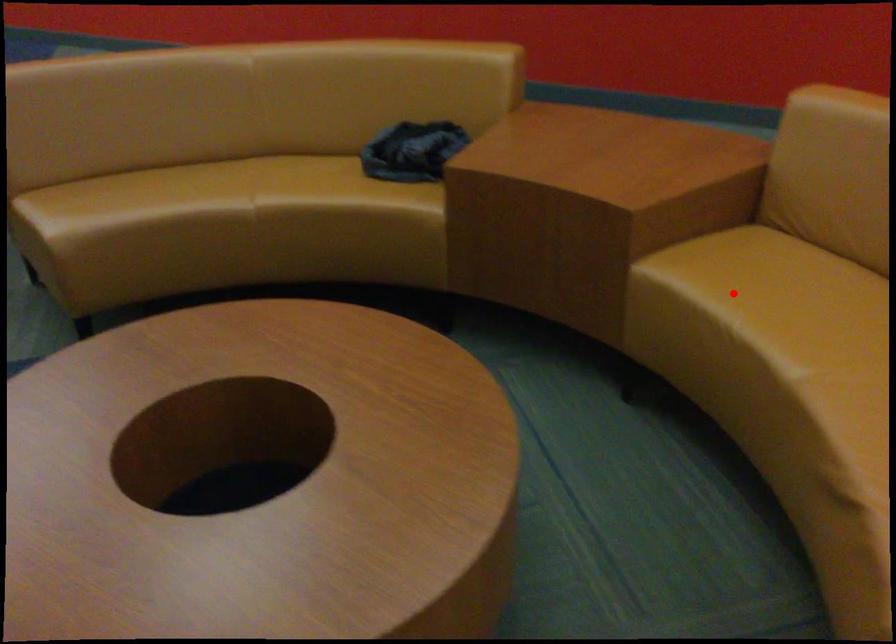
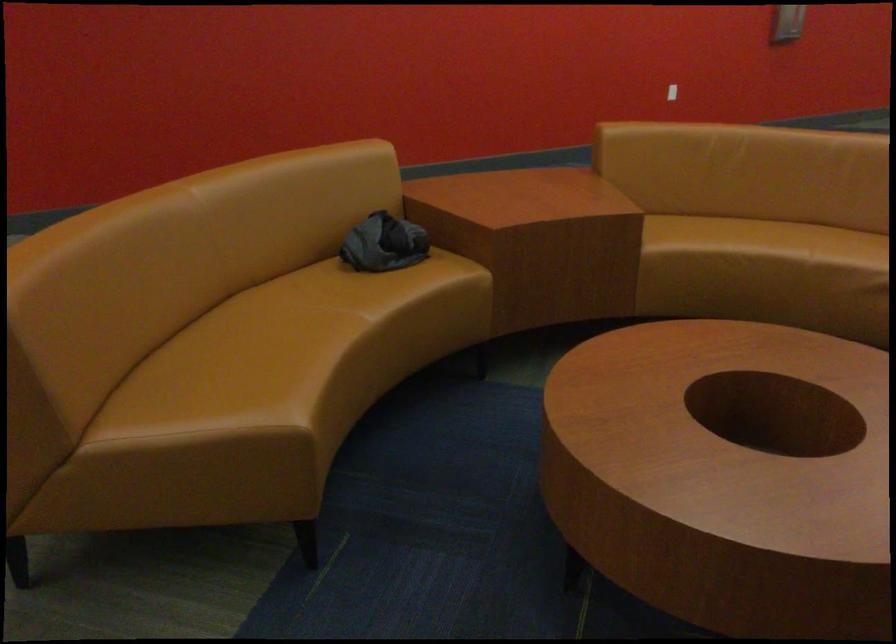
Question: A red point is marked in image1. In image2, is the corresponding 3D point closer to the camera or farther? Reply with the corresponding letter.

Choices:
 (A) The corresponding 3D point is closer.
 (B) The corresponding 3D point is farther.

Answer: (B)